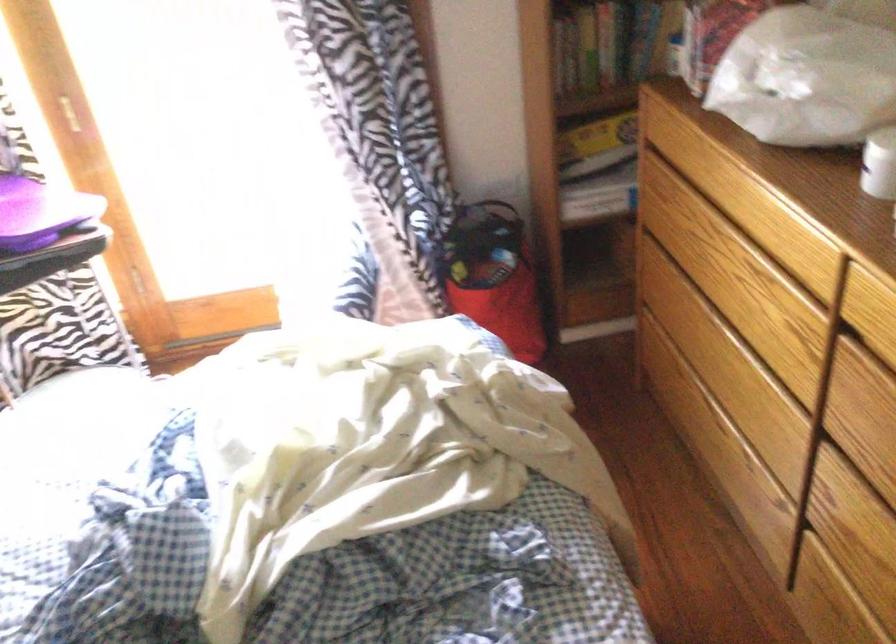
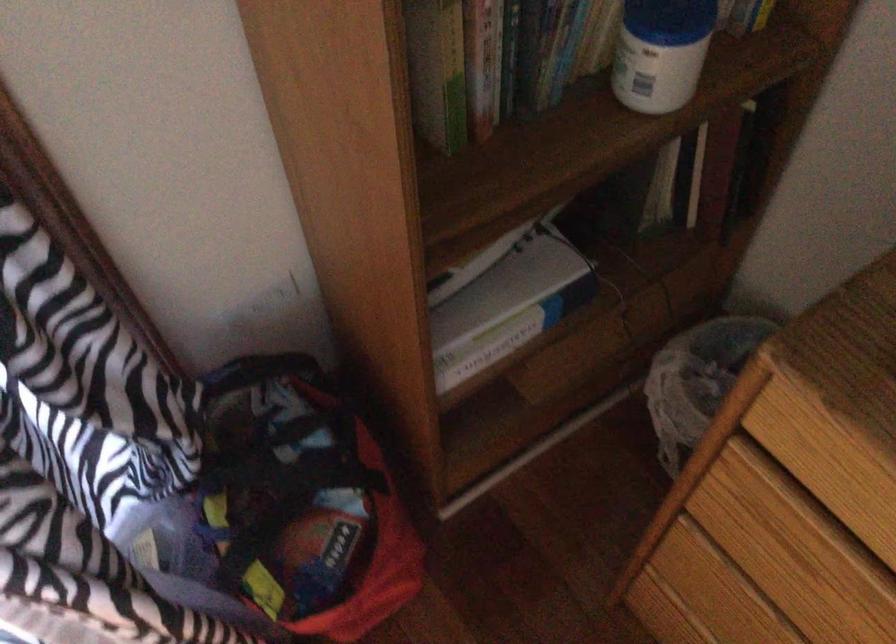
Where in the second image is the point corresponding to (x=657, y=268) from the first image?

(717, 590)